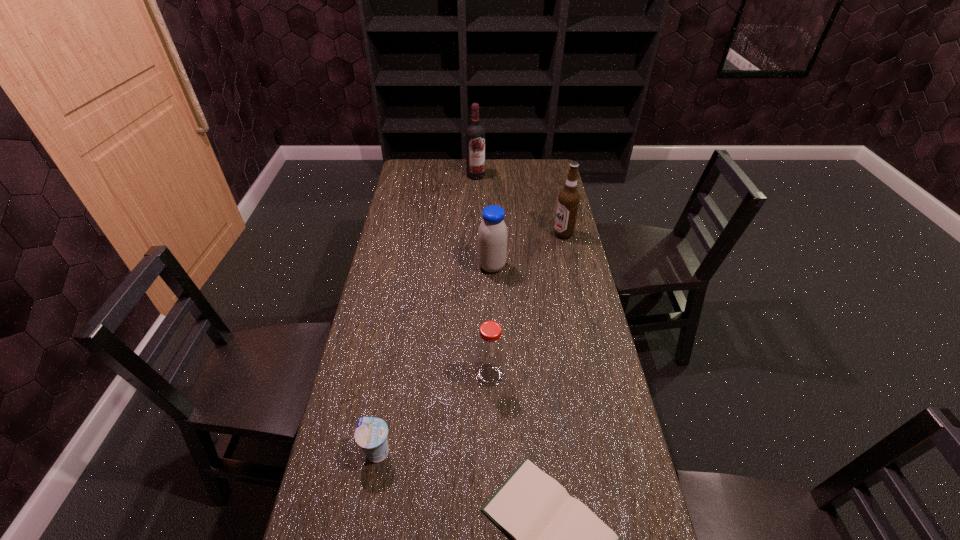
Select which object is the closest to the soya milk. Please provide its 2D coordinates. Your answer should be formatted as a tuple, i.e. [(x, y)], where the tuple contains the x and y coordinates of a point satisfying the conditions above.

[(568, 201)]

You are a GUI agent. You are given a task and a screenshot of the screen. Output one action in this format:
    pyautogui.click(x=<x>, y=<y>)
    Task: Click on the free region that satisfies the following two spatial constraints: 1. on the label of the fifth nearest object; 2. on the front side of the third shortest object
    The height and width of the screenshot is (540, 960).
    Given the screenshot: What is the action you would take?
    pyautogui.click(x=595, y=375)